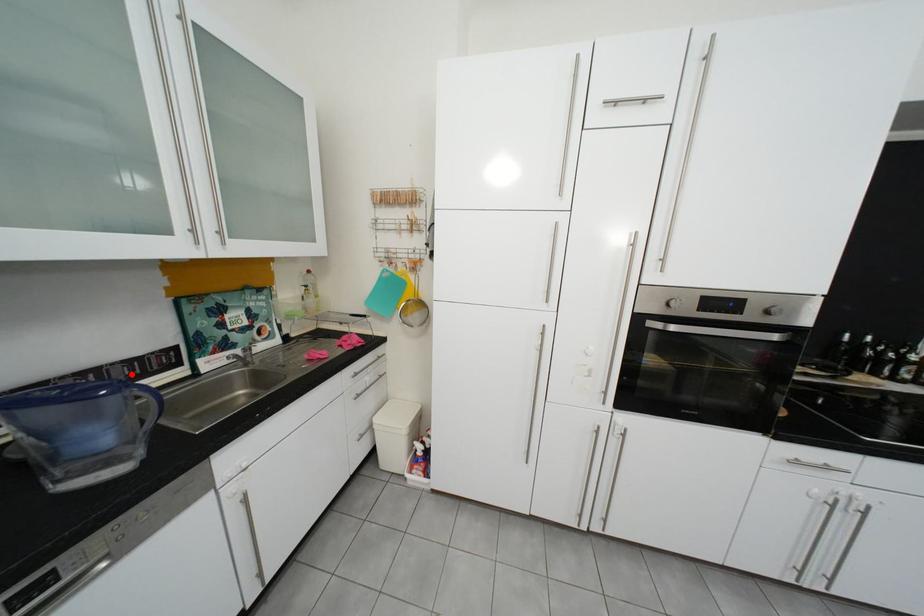
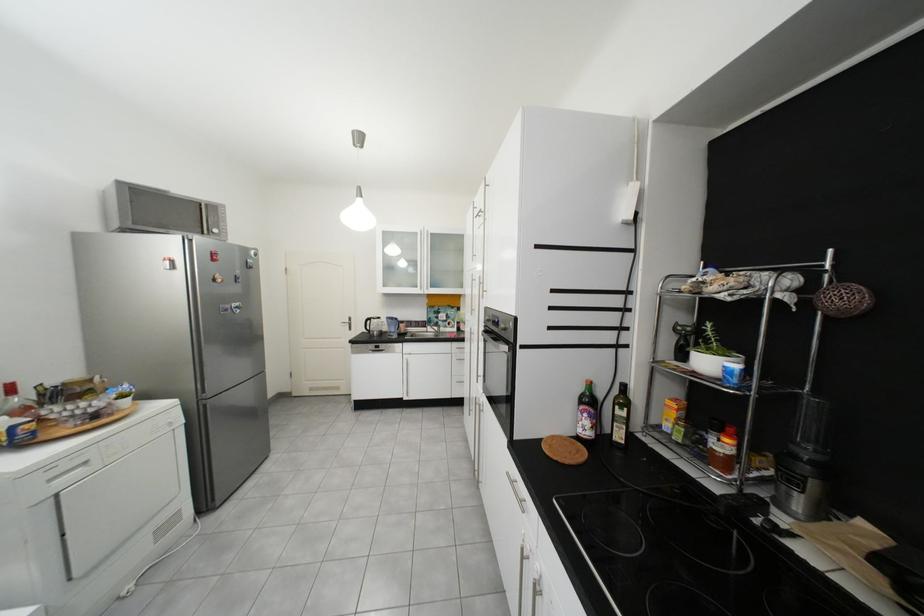
In the second image, find the point that corresponds to the highlighted location in the first image.

(426, 325)